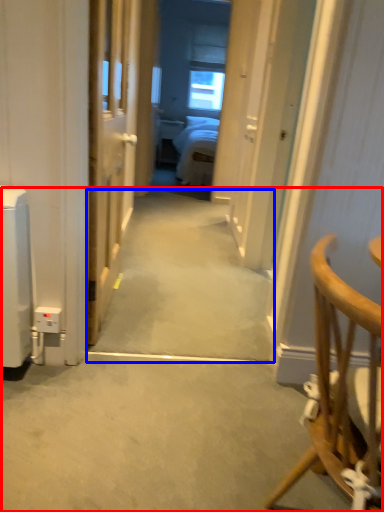
Question: Which point is further to the camera, path (highlighted by a red box) or path (highlighted by a blue box)?

Choices:
 (A) path
 (B) path

Answer: (B)